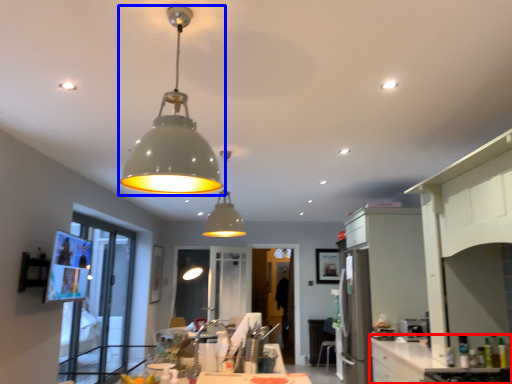
Question: Among these objects, which one is farthest to the camera, counter top (highlighted by a red box) or lamp (highlighted by a blue box)?

Choices:
 (A) counter top
 (B) lamp

Answer: (A)